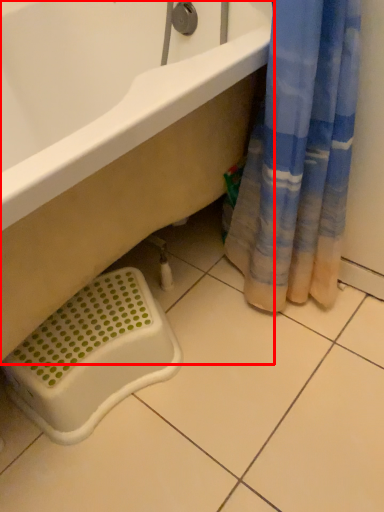
Question: Considering the relative positions of bathtub (annotated by the red box) and laundry basket in the image provided, where is bathtub (annotated by the red box) located with respect to the staircase?

Choices:
 (A) left
 (B) right

Answer: (A)